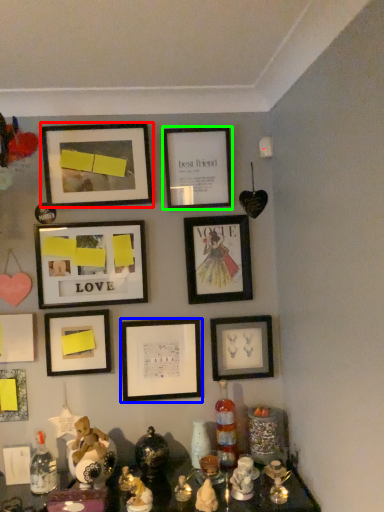
Question: Estimate the real-world distances between objects in this image. Which object is closer to picture frame (highlighted by a red box), picture frame (highlighted by a blue box) or picture frame (highlighted by a green box)?

Choices:
 (A) picture frame
 (B) picture frame

Answer: (B)